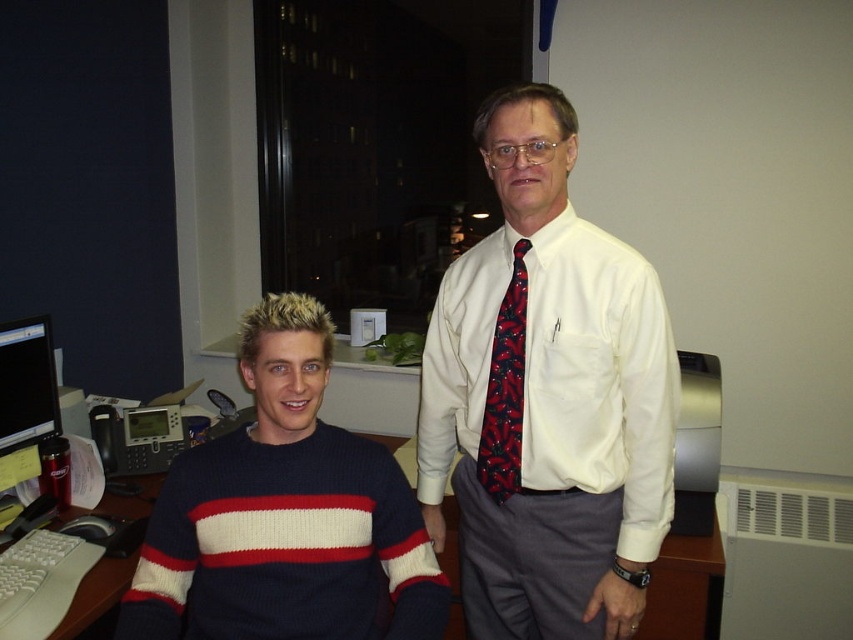
Question: Does white cotton dress shirt at center have a greater width compared to dark red textured tie at center?

Choices:
 (A) yes
 (B) no

Answer: (A)

Question: Which point is closer to the camera?

Choices:
 (A) (509, 300)
 (B) (231, 492)

Answer: (B)

Question: Estimate the real-world distances between objects in this image. Which object is closer to the white cotton dress shirt at center?

Choices:
 (A) dark red textured tie at center
 (B) knit sweater at left

Answer: (A)

Question: Is knit sweater at left further to the viewer compared to dark red textured tie at center?

Choices:
 (A) yes
 (B) no

Answer: (B)

Question: Can you confirm if knit sweater at left is wider than dark red textured tie at center?

Choices:
 (A) no
 (B) yes

Answer: (B)

Question: Among these points, which one is nearest to the camera?

Choices:
 (A) (256, 360)
 (B) (512, 358)

Answer: (A)